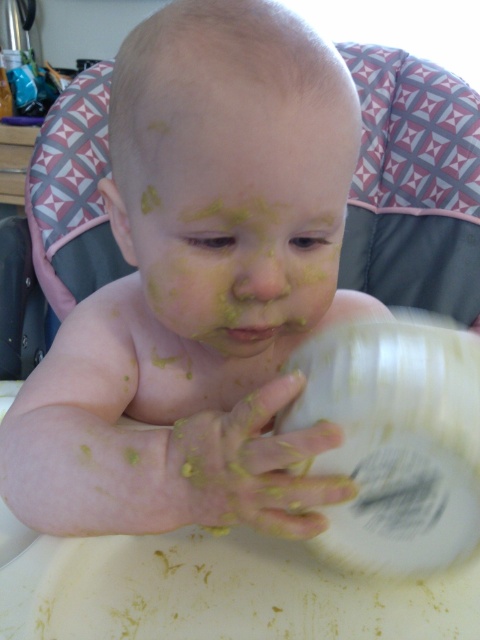
Who is more forward, (250,132) or (182,476)?

Point (250,132) is in front.

I want to click on yellow matte face at center, so click(x=241, y=218).

Is yellow matte baby at center wider than yellowish paste at center?

Yes.

Locate an element on the screen. The height and width of the screenshot is (640, 480). yellow matte baby at center is located at coordinates (200, 285).

Find the location of a particular element. yellow matte baby at center is located at coordinates (200, 285).

Is point (196, 230) positioned in front of point (322, 243)?

Yes, it is in front of point (322, 243).

Is point (236, 385) more distant than point (224, 317)?

Yes, it is.

You are a GUI agent. You are given a task and a screenshot of the screen. Output one action in this format:
    pyautogui.click(x=<x>, y=<y>)
    Task: Click on the yellow matte baby at center
    
    Given the screenshot: What is the action you would take?
    pyautogui.click(x=200, y=285)